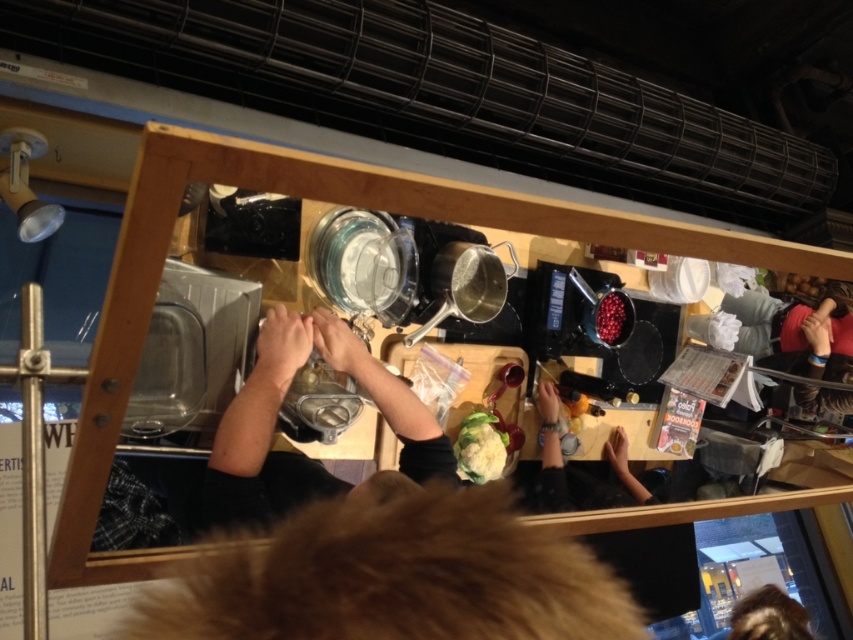
Between point (506, 580) and point (374, 371), which one is positioned in front?

Positioned in front is point (506, 580).

Who is taller, brown fur at center or metallic silver pot at center?

metallic silver pot at center is taller.

The width and height of the screenshot is (853, 640). Identify the location of brown fur at center. (392, 573).

In the scene shown: Is brown fur at center behind shiny red berries at center?

No.

Which of these two, brown fur at center or shiny red berries at center, stands taller?

With more height is brown fur at center.

This screenshot has width=853, height=640. I want to click on brown fur at center, so click(x=392, y=573).

Is brown hair at lower right above white textured cauliflower at center?

No, brown hair at lower right is not above white textured cauliflower at center.

Does brown hair at lower right have a larger size compared to white textured cauliflower at center?

Yes, brown hair at lower right is bigger than white textured cauliflower at center.

Locate an element on the screen. The image size is (853, 640). brown hair at lower right is located at coordinates (769, 616).